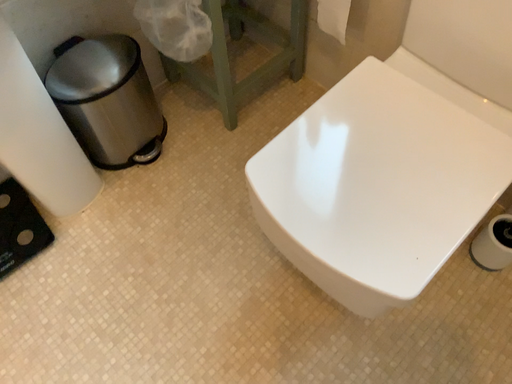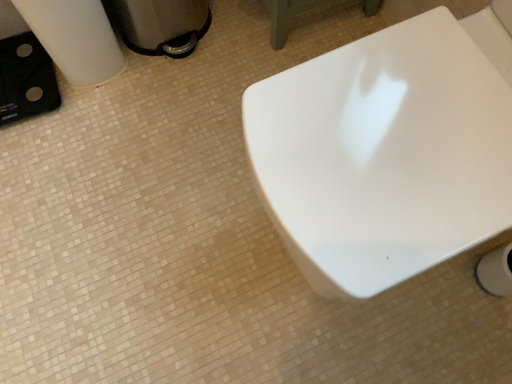
Question: Which way did the camera rotate in the video?

Choices:
 (A) rotated upward
 (B) rotated downward

Answer: (B)